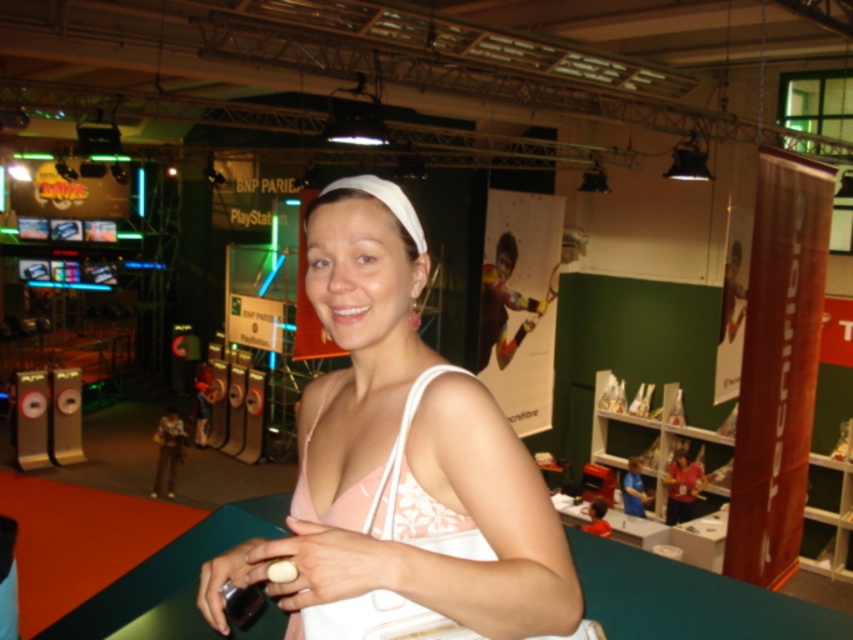
Question: Among these points, which one is nearest to the camera?

Choices:
 (A) (506, 529)
 (B) (345, 600)

Answer: (A)

Question: Which point appears farthest from the camera in this image?

Choices:
 (A) (347, 211)
 (B) (294, 620)

Answer: (B)

Question: Is white fabric purse at center to the right of pink fabric dress at center from the viewer's perspective?

Choices:
 (A) no
 (B) yes

Answer: (A)

Question: In this image, where is white fabric purse at center located relative to pink fabric dress at center?

Choices:
 (A) left
 (B) right

Answer: (A)

Question: Does white fabric purse at center appear on the right side of pink fabric dress at center?

Choices:
 (A) yes
 (B) no

Answer: (B)